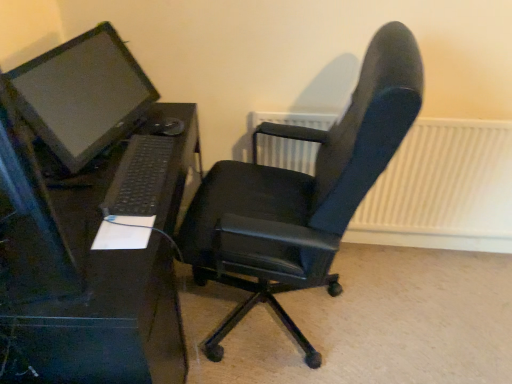
Locate an element on the screen. This screenshot has height=384, width=512. black plastic desk at left is located at coordinates (94, 256).

The height and width of the screenshot is (384, 512). What are the coordinates of `black plastic keyboard at lower left` in the screenshot? It's located at (139, 177).

Measure the distance between point [96,87] and camera.

Point [96,87] and camera are 4.83 feet apart.

Locate an element on the screen. This screenshot has height=384, width=512. white textured radiator at upper right is located at coordinates (445, 182).

Considering the relative sizes of black plastic keyboard at lower left and matte black monitor at left in the image provided, is black plastic keyboard at lower left smaller than matte black monitor at left?

Yes, black plastic keyboard at lower left is smaller than matte black monitor at left.

Who is taller, black plastic keyboard at lower left or matte black monitor at left?

Standing taller between the two is matte black monitor at left.

Would you say black plastic keyboard at lower left is outside matte black monitor at left?

Yes, black plastic keyboard at lower left is outside of matte black monitor at left.

From a real-world perspective, which is physically below, black plastic keyboard at lower left or matte black monitor at left?

In real-world perspective, black plastic keyboard at lower left is lower.

Considering the relative sizes of black plastic keyboard at lower left and black plastic desk at left in the image provided, is black plastic keyboard at lower left taller than black plastic desk at left?

Incorrect, the height of black plastic keyboard at lower left is not larger of that of black plastic desk at left.

Who is smaller, black plastic keyboard at lower left or black plastic desk at left?

Smaller between the two is black plastic keyboard at lower left.

Is black plastic desk at left at the back of black plastic keyboard at lower left?

No.

Does point (139, 192) come in front of point (160, 206)?

Yes, it is in front of point (160, 206).

Does point (154, 138) come in front of point (257, 149)?

Yes, point (154, 138) is closer to viewer.

Consider the image. Considering the relative sizes of black plastic keyboard at lower left and white textured radiator at upper right in the image provided, is black plastic keyboard at lower left taller than white textured radiator at upper right?

Incorrect, the height of black plastic keyboard at lower left is not larger of that of white textured radiator at upper right.

Is black plastic keyboard at lower left turned away from white textured radiator at upper right?

No, black plastic keyboard at lower left's orientation is not away from white textured radiator at upper right.

The image size is (512, 384). What are the coordinates of `radiator that appears on the right of black plastic keyboard at lower left` in the screenshot? It's located at (445, 182).

Is black leather office chair at center wider than black plastic keyboard at lower left?

Yes.

Is black leather office chair at center looking in the opposite direction of black plastic keyboard at lower left?

No, black plastic keyboard at lower left is not at the back of black leather office chair at center.

Which of these two, black leather office chair at center or black plastic keyboard at lower left, stands shorter?

black plastic keyboard at lower left is shorter.

Does black leather office chair at center appear on the right side of black plastic keyboard at lower left?

Correct, you'll find black leather office chair at center to the right of black plastic keyboard at lower left.

What's the angular difference between black plastic desk at left and matte black monitor at left's facing directions?

14 degrees separate the facing orientations of black plastic desk at left and matte black monitor at left.

Is matte black monitor at left inside black plastic desk at left?

That's incorrect, matte black monitor at left is not inside black plastic desk at left.

Does black plastic desk at left lie behind matte black monitor at left?

No, black plastic desk at left is in front of matte black monitor at left.

How much distance is there between black plastic desk at left and matte black monitor at left?

A distance of 10.69 inches exists between black plastic desk at left and matte black monitor at left.

From a real-world perspective, does white textured radiator at upper right stand above black plastic keyboard at lower left?

No, from a real-world perspective, white textured radiator at upper right is not on top of black plastic keyboard at lower left.

From the image's perspective, is white textured radiator at upper right below black plastic keyboard at lower left?

Correct, white textured radiator at upper right appears lower than black plastic keyboard at lower left in the image.

In the scene shown: Does white textured radiator at upper right have a greater height compared to black plastic keyboard at lower left?

Yes, white textured radiator at upper right is taller than black plastic keyboard at lower left.

Can black plastic keyboard at lower left be found inside white textured radiator at upper right?

No, black plastic keyboard at lower left is not a part of white textured radiator at upper right.

From the image's perspective, relative to matte black monitor at left, is black leather office chair at center above or below?

Clearly, from the image's perspective, black leather office chair at center is below matte black monitor at left.

Based on the photo, from a real-world perspective, is black leather office chair at center physically located above or below matte black monitor at left?

black leather office chair at center is below matte black monitor at left.

Is black leather office chair at center far from matte black monitor at left?

No, black leather office chair at center is not far away from matte black monitor at left.

Which is farther from the camera, (x=364, y=142) or (x=58, y=112)?

The point (x=58, y=112) is farther.

At what (x,y) coordinates should I click in order to perform the action: click on computer monitor that appears above the black plastic keyboard at lower left (from a real-world perspective). Please return your answer as a coordinate pair (x, y). Looking at the image, I should click on (82, 95).

The width and height of the screenshot is (512, 384). In the image, there is a black plastic keyboard at lower left. Identify the location of desk below it (from the image's perspective). (94, 256).

Considering their positions, is matte black monitor at left positioned closer to black plastic desk at left than black plastic keyboard at lower left?

black plastic keyboard at lower left.

Considering their positions, is white textured radiator at upper right positioned closer to black plastic keyboard at lower left than black plastic desk at left?

black plastic desk at left.

Which object lies further to the anchor point black plastic keyboard at lower left, matte black monitor at left or black leather office chair at center?

The object further to black plastic keyboard at lower left is black leather office chair at center.

From the image, which object appears to be nearer to black leather office chair at center, matte black monitor at left or black plastic desk at left?

black plastic desk at left lies closer to black leather office chair at center than the other object.

Which object lies further to the anchor point matte black monitor at left, black leather office chair at center or black plastic desk at left?

black leather office chair at center is further to matte black monitor at left.

Which object lies further to the anchor point black leather office chair at center, black plastic keyboard at lower left or black plastic desk at left?

black plastic keyboard at lower left is positioned further to the anchor black leather office chair at center.

In the scene shown: Based on their spatial positions, is matte black monitor at left or white textured radiator at upper right further from black leather office chair at center?

Among the two, white textured radiator at upper right is located further to black leather office chair at center.

When comparing their distances from black plastic desk at left, does white textured radiator at upper right or black leather office chair at center seem closer?

black leather office chair at center is closer to black plastic desk at left.

At what (x,y) coordinates should I click in order to perform the action: click on computer keyboard that lies between matte black monitor at left and black plastic desk at left from top to bottom. Please return your answer as a coordinate pair (x, y). Looking at the image, I should click on pyautogui.click(x=139, y=177).

Find the location of a particular element. computer keyboard between black plastic desk at left and white textured radiator at upper right in the horizontal direction is located at coordinates (139, 177).

Find the location of `computer keyboard between matte black monitor at left and white textured radiator at upper right from left to right`. computer keyboard between matte black monitor at left and white textured radiator at upper right from left to right is located at coordinates (139, 177).

At what (x,y) coordinates should I click in order to perform the action: click on desk between matte black monitor at left and black leather office chair at center in the horizontal direction. Please return your answer as a coordinate pair (x, y). Image resolution: width=512 pixels, height=384 pixels. Looking at the image, I should click on (94, 256).